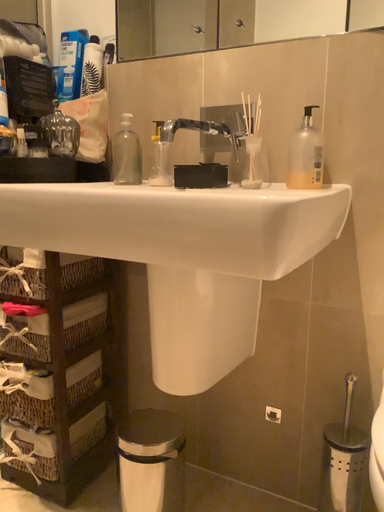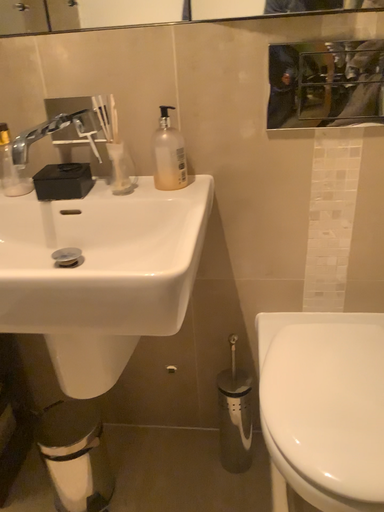
Question: How did the camera likely rotate when shooting the video?

Choices:
 (A) rotated left
 (B) rotated right

Answer: (B)